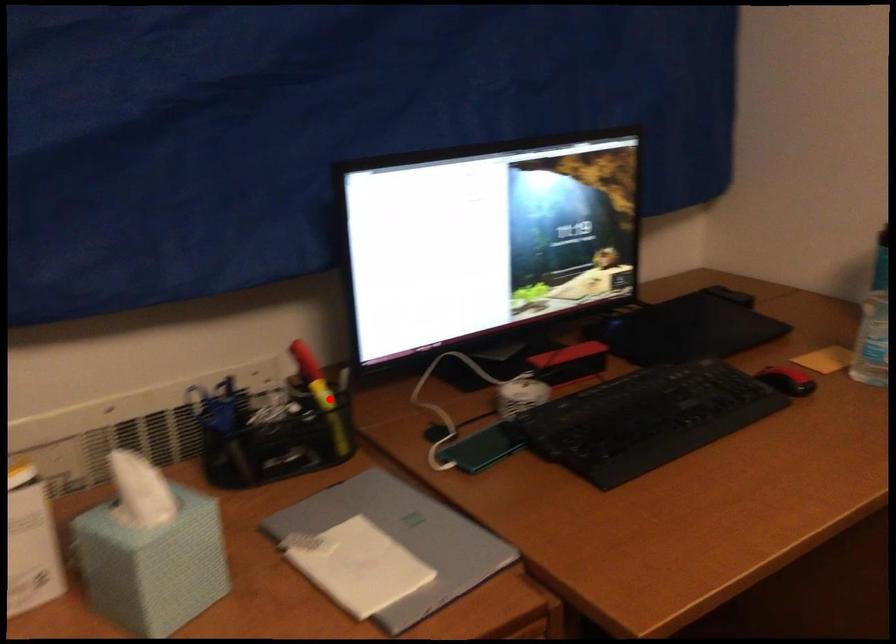
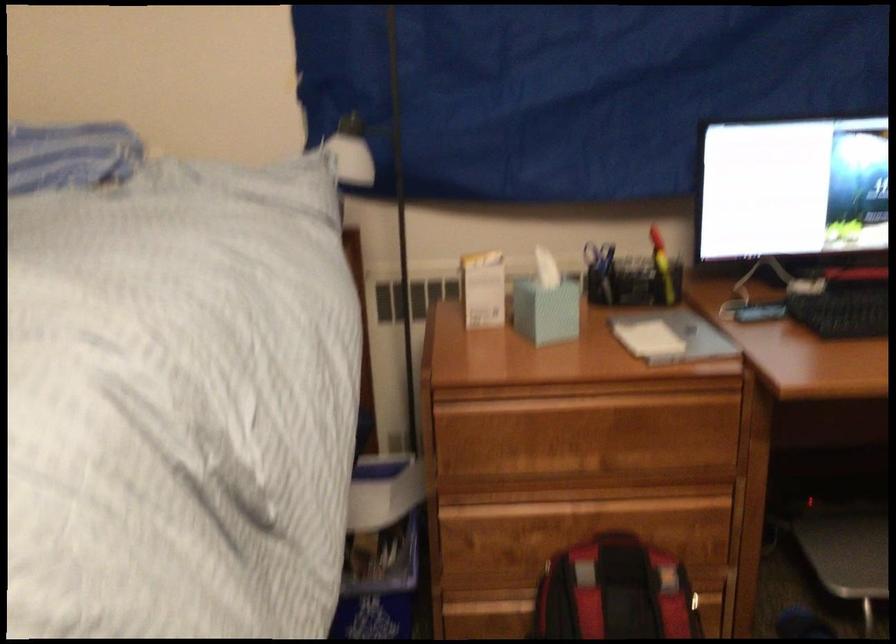
Question: I am providing you with two images of the same scene from different viewpoints. Given a red point in image1, look at the same physical point in image2. Is it:

Choices:
 (A) Closer to the viewpoint
 (B) Farther from the viewpoint

Answer: (B)